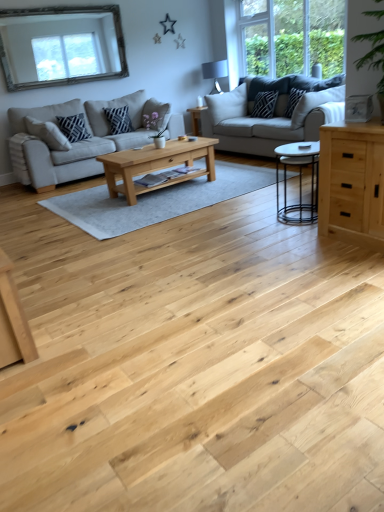
The image size is (384, 512). I want to click on vacant space behind black metal coffee table at center, the 1th coffee table in the right-to-left sequence, so click(273, 203).